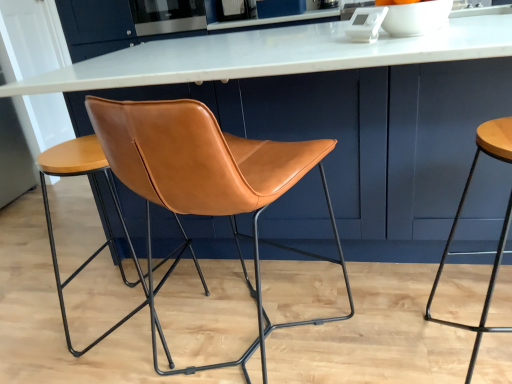
This screenshot has width=512, height=384. Identify the location of vacant space behind saddle brown leather chair at center. (260, 278).